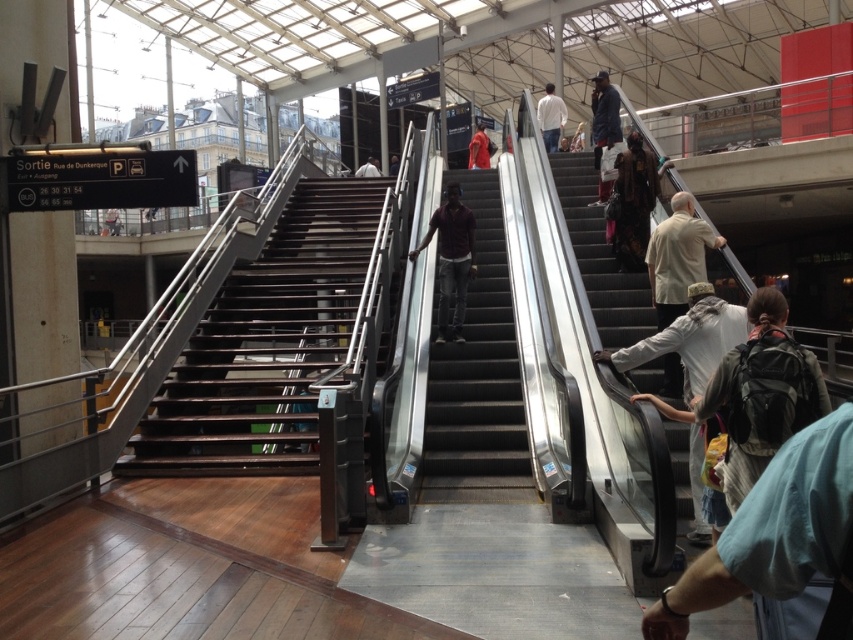
You are standing at the base of the metallic gray escalator at right and the maroon shirt at center is visible above you. Which object is higher up?

The metallic gray escalator at right is taller than the maroon shirt at center, so the metallic gray escalator at right is higher up.

You are standing at the entrance of the transportation hub and see two people wearing dark gray jeans at center and dark brown leather jacket at center. You need to deliver a package to the person who is closer to you. Which person should you approach?

The dark gray jeans at center is 4.63 meters away from dark brown leather jacket at center. Since both are at center, it is unclear which is closer without additional information. Please check their exact positions.

You are standing at the bottom of the escalators in the train station and see two people wearing dark gray jeans at center and dark brown leather jacket at center. Which person is closer to your left side?

The dark gray jeans at center is to the left of dark brown leather jacket at center, so the person wearing dark gray jeans at center is closer to your left side.